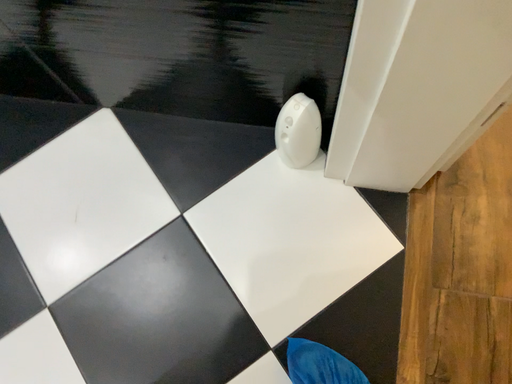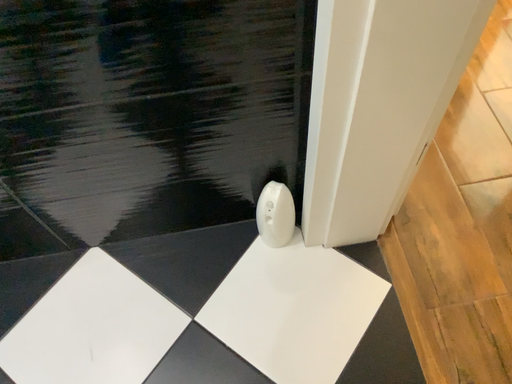
Question: Which way did the camera rotate in the video?

Choices:
 (A) rotated left
 (B) rotated right

Answer: (B)